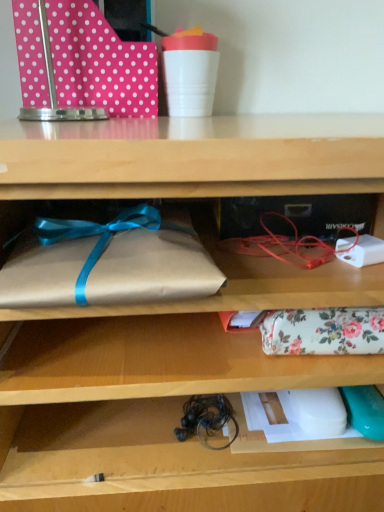
Question: Is pink polka dot wrapping paper at upper left wider or thinner than brown paper wrapped at left, which is counted as the 2th wrap, starting from the right?

Choices:
 (A) thin
 (B) wide

Answer: (A)

Question: Visually, is pink polka dot wrapping paper at upper left positioned to the left or to the right of brown paper wrapped at left, which is the 1th wrap from front to back?

Choices:
 (A) right
 (B) left

Answer: (B)

Question: Estimate the real-world distances between objects in this image. Which object is farther from the black rubber twine at lower center?

Choices:
 (A) pink polka dot wrapping paper at upper left
 (B) floral fabric pouch at center, which is the first wrap in back-to-front order
 (C) brown paper wrapped at left, which is the first wrap from left to right

Answer: (A)

Question: Which is nearer to the floral fabric pouch at center, which is counted as the 2th wrap, starting from the left?

Choices:
 (A) black rubber twine at lower center
 (B) pink polka dot wrapping paper at upper left
 (C) brown paper wrapped at left, which is counted as the 2th wrap, starting from the right

Answer: (A)